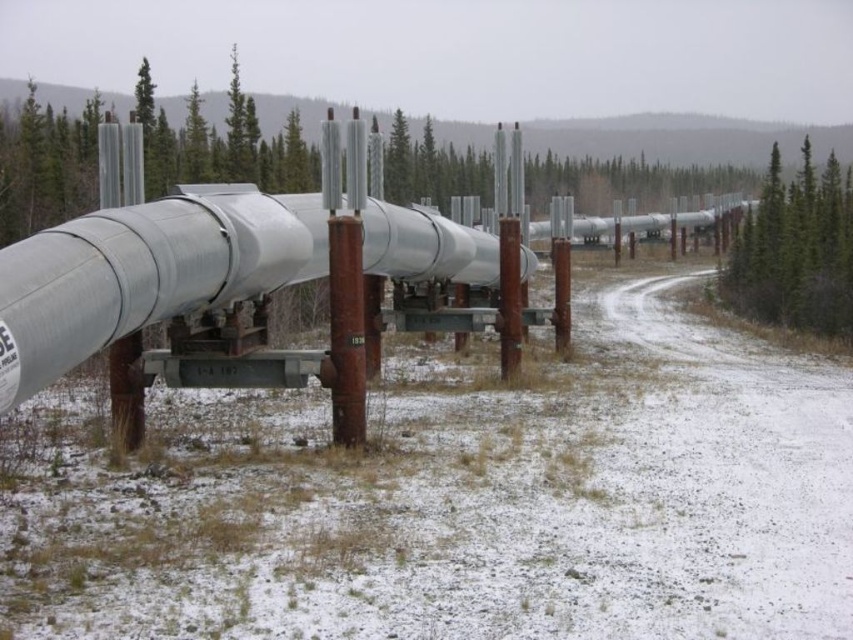
Question: Which point is closer to the camera?

Choices:
 (A) green textured pine tree at upper center
 (B) green leafy tree at upper right

Answer: (B)

Question: Is green leafy tree at upper right smaller than green textured pine tree at upper center?

Choices:
 (A) no
 (B) yes

Answer: (A)

Question: Which of the following is the farthest from the observer?

Choices:
 (A) (781, 269)
 (B) (231, 86)

Answer: (B)

Question: Considering the relative positions of green leafy tree at upper right and green textured pine tree at upper center in the image provided, where is green leafy tree at upper right located with respect to green textured pine tree at upper center?

Choices:
 (A) above
 (B) below

Answer: (B)

Question: Which point is farther to the camera?

Choices:
 (A) green leafy tree at upper right
 (B) green textured pine tree at upper center

Answer: (B)

Question: Can you confirm if green leafy tree at upper right is positioned below green textured pine tree at upper center?

Choices:
 (A) no
 (B) yes

Answer: (B)